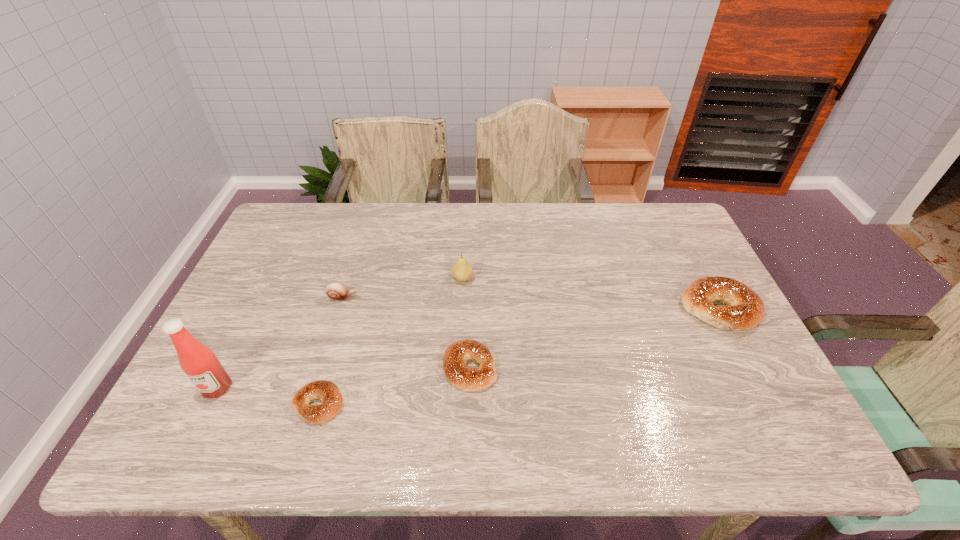
The height and width of the screenshot is (540, 960). What are the coordinates of `vacant space located 0.270m on the back of the leftmost bagel` in the screenshot? It's located at (348, 301).

Identify the location of free space located 0.280m on the right of the second shortest bagel. The image size is (960, 540). (611, 368).

I want to click on vacant space located 0.100m on the left of the farthest bagel, so tap(646, 308).

Locate an element on the screen. This screenshot has height=540, width=960. free space located 0.390m on the front-facing side of the escargot is located at coordinates (495, 298).

Identify the location of free space located on the back of the fifth shortest object. This screenshot has width=960, height=540. (465, 214).

I want to click on condiment that is positioned at the near edge, so click(200, 364).

The image size is (960, 540). What are the coordinates of `object at the left edge` in the screenshot? It's located at (200, 364).

Locate an element on the screen. The width and height of the screenshot is (960, 540). object present at the right edge is located at coordinates (745, 309).

Where is `object at the near left corner`? This screenshot has width=960, height=540. object at the near left corner is located at coordinates (200, 364).

In order to click on vacant space at the far edge of the desktop in this screenshot , I will do `click(465, 235)`.